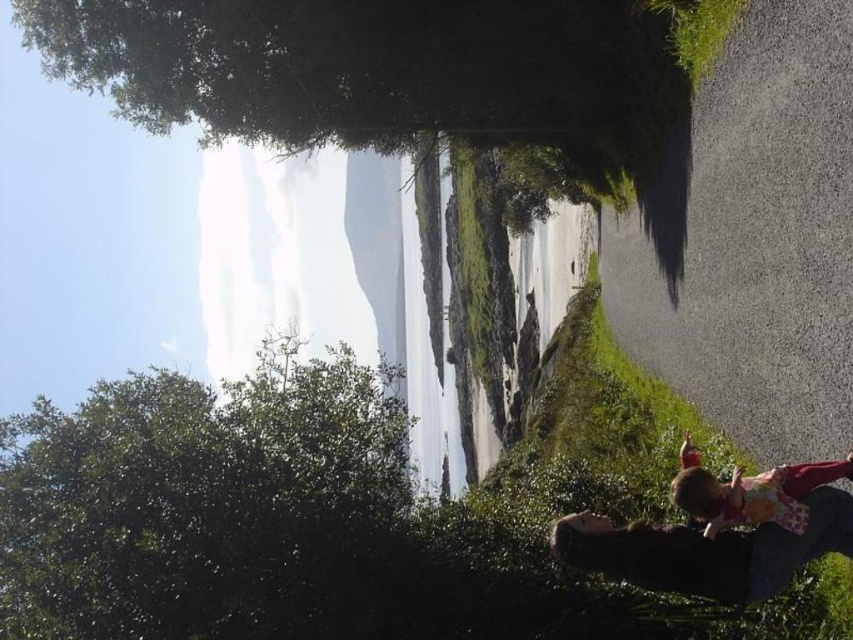
Question: Which object appears farthest from the camera in this image?

Choices:
 (A) floral dress at lower right
 (B) green leafy tree at upper left

Answer: (B)

Question: Which point appears farthest from the camera in this image?

Choices:
 (A) (165, 577)
 (B) (708, 515)

Answer: (A)

Question: Where is green leafy tree at upper left located in relation to floral dress at lower right in the image?

Choices:
 (A) above
 (B) below

Answer: (B)

Question: Does green leafy tree at upper left appear under floral dress at lower right?

Choices:
 (A) no
 (B) yes

Answer: (B)

Question: Does green leafy tree at upper left appear on the left side of floral dress at lower right?

Choices:
 (A) yes
 (B) no

Answer: (A)